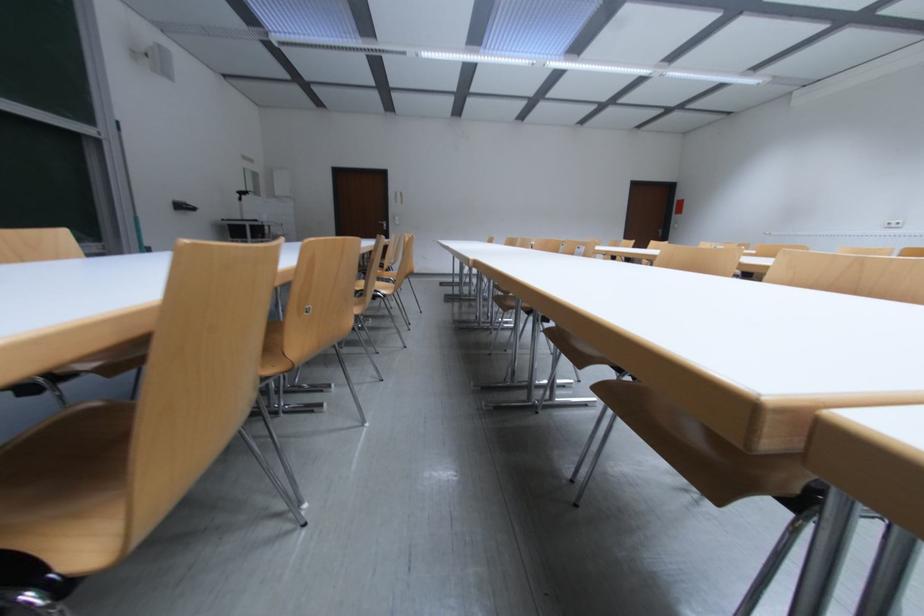
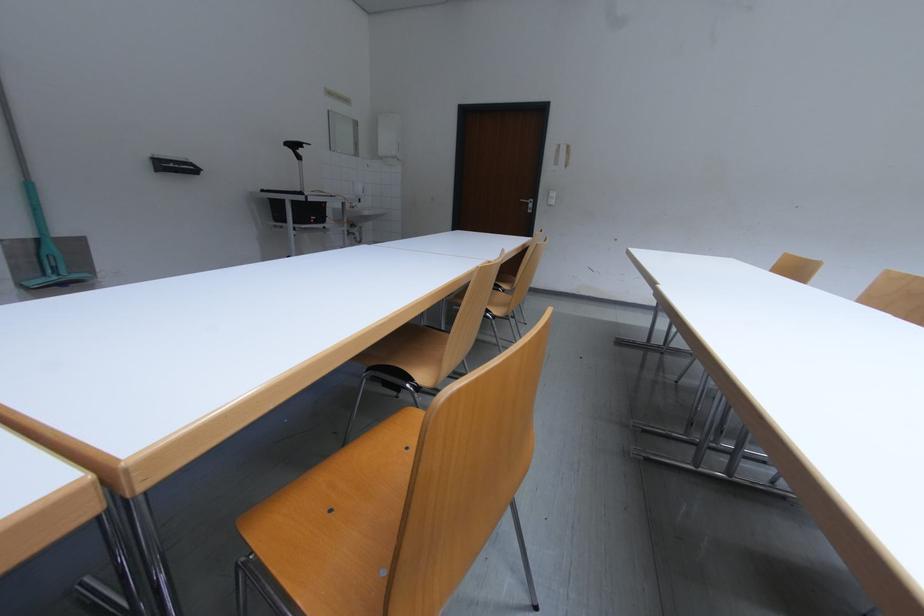
Find the pixel in the second image that matches [388,224] in the first image.

(531, 201)